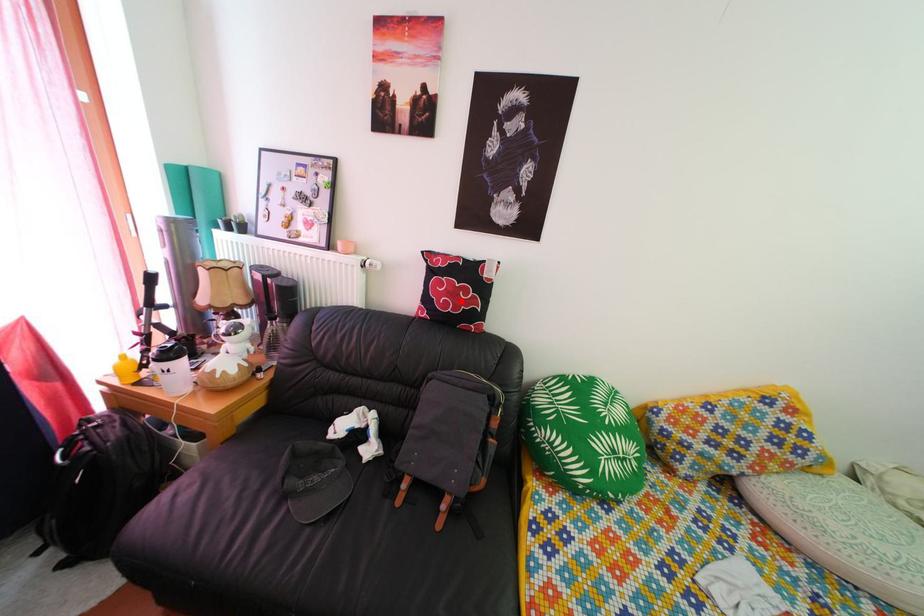
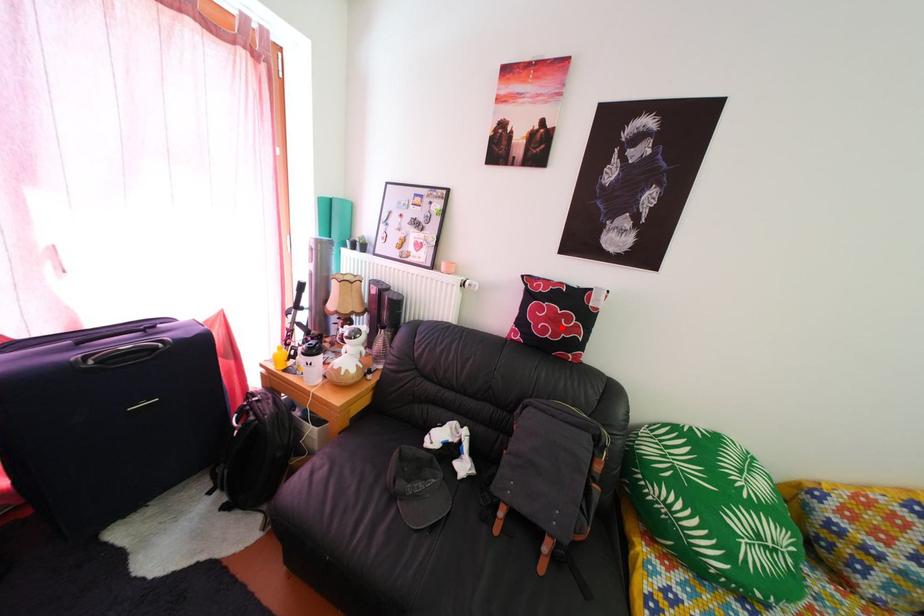
I am providing you with two images of the same scene from different viewpoints. A red point is marked on the first image and another point is marked on the second image. Is the marked point in image1 the same physical position as the marked point in image2?

Yes